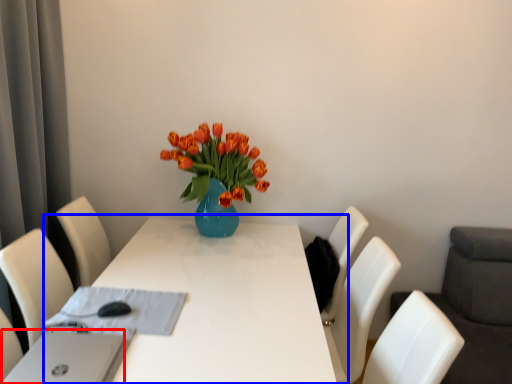
Question: Among these objects, which one is nearest to the camera, computer (highlighted by a red box) or table (highlighted by a blue box)?

Choices:
 (A) computer
 (B) table

Answer: (A)